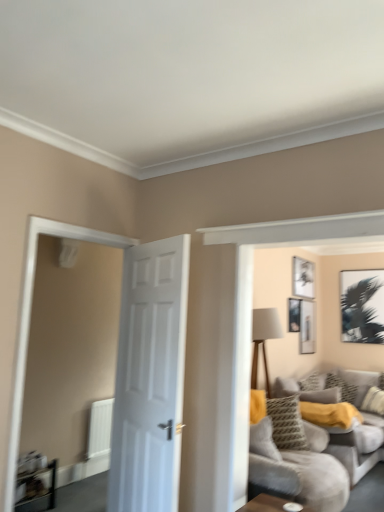
Question: Looking at the image, does clear glass door at left seem bigger or smaller compared to black matte picture frame at upper right, arranged as the 1th picture frame when viewed from the right?

Choices:
 (A) big
 (B) small

Answer: (A)

Question: In terms of width, does clear glass door at left look wider or thinner when compared to black matte picture frame at upper right, arranged as the 1th picture frame when viewed from the right?

Choices:
 (A) wide
 (B) thin

Answer: (A)

Question: Estimate the real-world distances between objects in this image. Which object is closer to the white glossy door at center?

Choices:
 (A) patterned fabric pillow at center-right, which appears as the first pillow when viewed from the left
 (B) clear glass door at left
 (C) wooden table at lower left
 (D) soft gray fabric couch at right
 (E) matte black picture frame at upper right, which is the 3th picture frame in left-to-right order

Answer: (B)

Question: Which object is positioned closest to the patterned fabric pillow at right, which is the third pillow in left-to-right order?

Choices:
 (A) matte black picture frame at upper right, which is the 3th picture frame in left-to-right order
 (B) soft gray fabric couch at right
 (C) matte black picture frame at upper center, marked as the first picture frame in a left-to-right arrangement
 (D) black matte picture frame at upper right, the fourth picture frame in the left-to-right sequence
 (E) patterned fabric pillow at center-right, arranged as the third pillow when viewed from the right

Answer: (E)